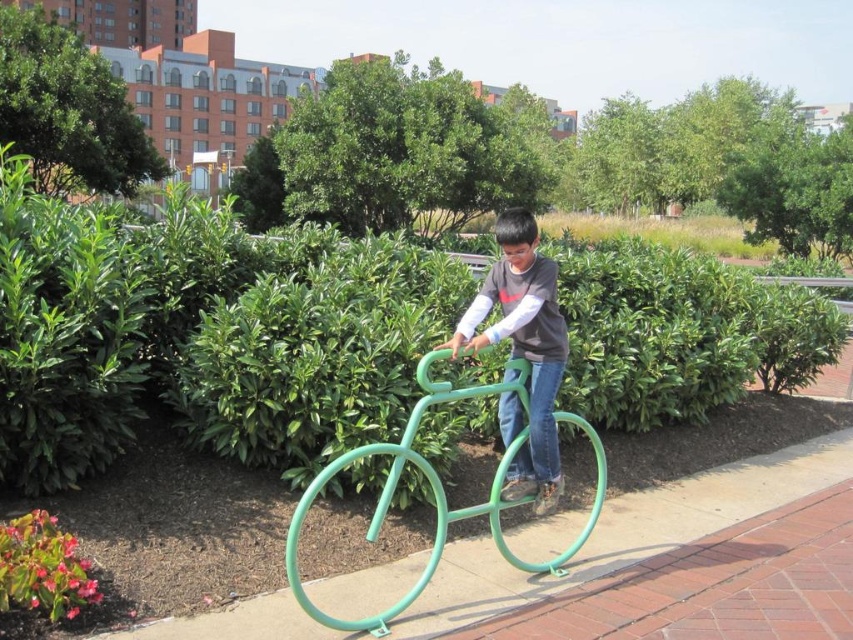
Between green leafy bush at upper center and green matte bicycle at center, which one is positioned lower?

Positioned lower is green matte bicycle at center.

How distant is green leafy bush at upper center from green matte bicycle at center?

A distance of 13.97 meters exists between green leafy bush at upper center and green matte bicycle at center.

Is point (412, 115) farther from camera compared to point (309, 497)?

Yes, point (412, 115) is behind point (309, 497).

You are a GUI agent. You are given a task and a screenshot of the screen. Output one action in this format:
    pyautogui.click(x=<x>, y=<y>)
    Task: Click on the green leafy bush at upper center
    Image resolution: width=853 pixels, height=640 pixels.
    Given the screenshot: What is the action you would take?
    pyautogui.click(x=402, y=150)

Between point (415, 136) and point (537, 317), which one is positioned in front?

Positioned in front is point (537, 317).

Does green leafy bush at upper center come behind matte green bicycle at center?

Yes, it is.

Between point (474, 112) and point (527, 477), which one is positioned in front?

Positioned in front is point (527, 477).

The image size is (853, 640). Identify the location of green leafy bush at upper center. (402, 150).

Who is lower down, green leafy bush at upper left or matte green bicycle at center?

matte green bicycle at center is lower down.

Is green leafy bush at upper left thinner than matte green bicycle at center?

Incorrect, green leafy bush at upper left's width is not less than matte green bicycle at center's.

Between point (96, 88) and point (546, 474), which one is positioned in front?

Point (546, 474)

Image resolution: width=853 pixels, height=640 pixels. Identify the location of green leafy bush at upper left. point(68,109).